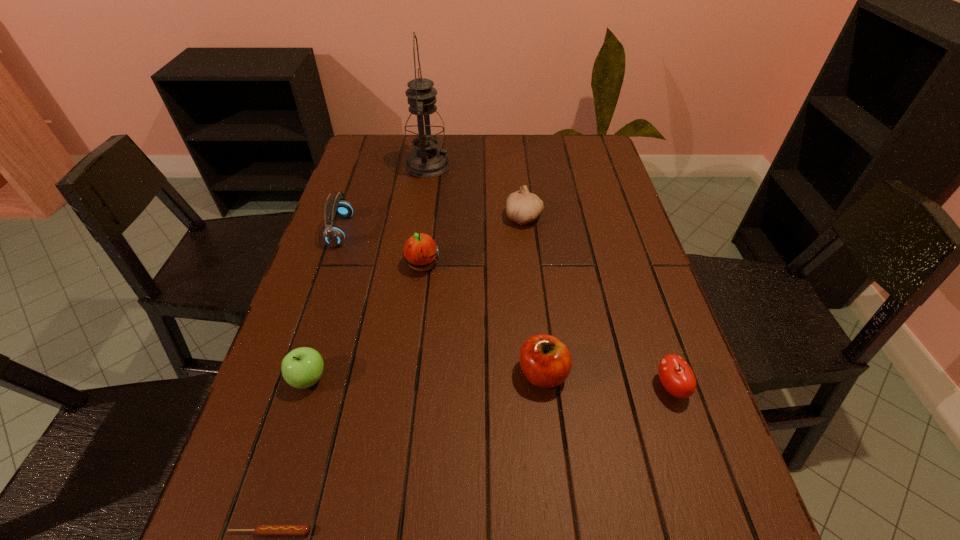
Locate an element on the screen. This screenshot has height=540, width=960. the shortest object is located at coordinates (263, 529).

The height and width of the screenshot is (540, 960). I want to click on free space located 0.100m on the back of the oil lamp, so click(432, 138).

At what (x,y) coordinates should I click in order to perform the action: click on vacant position located 0.050m on the ear cups of the headset. Please return your answer as a coordinate pair (x, y). This screenshot has height=540, width=960. Looking at the image, I should click on (369, 231).

This screenshot has width=960, height=540. Find the location of `free space located 0.160m on the back of the garlic`. free space located 0.160m on the back of the garlic is located at coordinates (519, 176).

You are a GUI agent. You are given a task and a screenshot of the screen. Output one action in this format:
    pyautogui.click(x=<x>, y=<y>)
    Task: Click on the vacant space located 0.180m on the right of the second apple from right to left
    The image size is (960, 540).
    Given the screenshot: What is the action you would take?
    pyautogui.click(x=654, y=374)

You are a GUI agent. You are given a task and a screenshot of the screen. Output one action in this format:
    pyautogui.click(x=<x>, y=<y>)
    Task: Click on the vacant area located 0.170m on the right of the third apple from right to left
    The width and height of the screenshot is (960, 540).
    Given the screenshot: What is the action you would take?
    pyautogui.click(x=505, y=265)

Find the location of a particular element. The image size is (960, 540). vacant space located on the back of the rightmost object is located at coordinates (646, 314).

At what (x,y) coordinates should I click in order to perform the action: click on vacant area located 0.180m on the front of the leftmost apple. Please return your answer as a coordinate pair (x, y). Looking at the image, I should click on (275, 491).

Locate an element on the screen. The height and width of the screenshot is (540, 960). vacant space located on the back of the shortest object is located at coordinates (320, 364).

Find the location of a particular element. Image resolution: width=960 pixels, height=540 pixels. object present at the far edge is located at coordinates (424, 128).